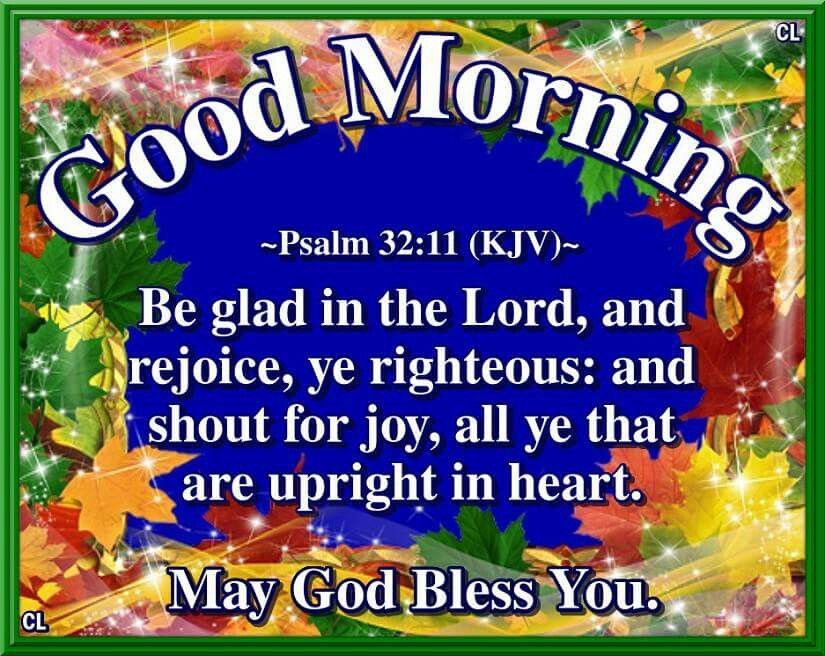
Identify the location of green frame. Image resolution: width=825 pixels, height=656 pixels. (811, 52).